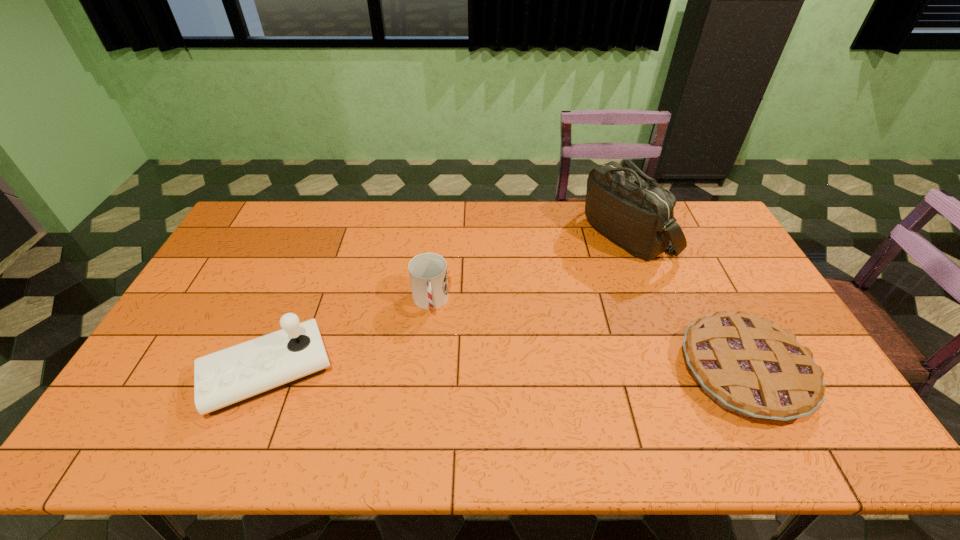
This screenshot has height=540, width=960. What are the coordinates of `vacant space located at the front padded panel of the farthest object` in the screenshot? It's located at (598, 267).

Where is `vacant area situated 0.110m at the front padded panel of the farthest object`? The width and height of the screenshot is (960, 540). vacant area situated 0.110m at the front padded panel of the farthest object is located at coordinates (588, 277).

You are a GUI agent. You are given a task and a screenshot of the screen. Output one action in this format:
    pyautogui.click(x=<x>, y=<y>)
    Task: Click on the free space located on the handle side of the second shortest object
    
    Given the screenshot: What is the action you would take?
    pyautogui.click(x=435, y=371)

Find the location of a particular element. The height and width of the screenshot is (540, 960). vacant point located 0.080m on the handle side of the second shortest object is located at coordinates (432, 343).

The height and width of the screenshot is (540, 960). What are the coordinates of `vacant space located on the handle side of the second shortest object` in the screenshot? It's located at (435, 374).

I want to click on object present at the far edge, so click(632, 210).

At what (x,y) coordinates should I click in order to perform the action: click on joystick located at the near edge. Please return your answer as a coordinate pair (x, y). The image size is (960, 540). Looking at the image, I should click on (224, 379).

Identify the location of pie at the near edge. This screenshot has height=540, width=960. (748, 365).

The height and width of the screenshot is (540, 960). I want to click on object positioned at the left edge, so click(224, 379).

At what (x,y) coordinates should I click in order to perform the action: click on object that is at the right edge. Please return your answer as a coordinate pair (x, y). This screenshot has width=960, height=540. Looking at the image, I should click on (748, 365).